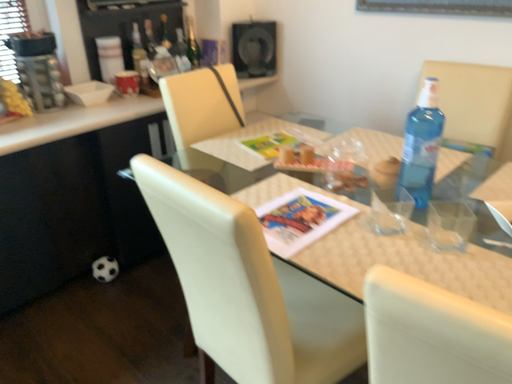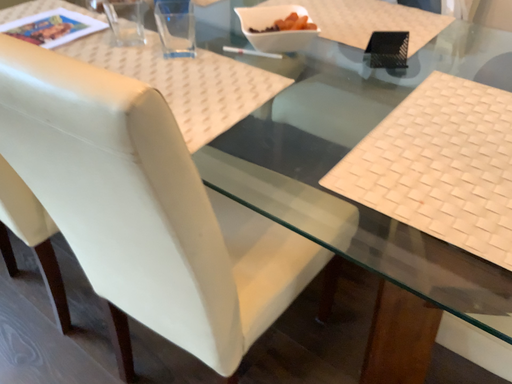
Question: How did the camera likely rotate when shooting the video?

Choices:
 (A) rotated downward
 (B) rotated upward

Answer: (A)